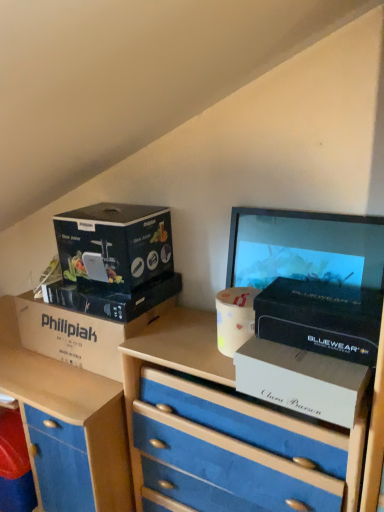
From the picture: In order to face white cardboard box at center-right, which is counted as the 4th box, starting from the left, should I rotate leftwards or rightwards?

Turn right approximately 14.653 degrees to face it.

The image size is (384, 512). Describe the element at coordinates (114, 244) in the screenshot. I see `matte black box at upper left, the fourth box positioned from the right` at that location.

What do you see at coordinates (59, 462) in the screenshot? I see `blue matte drawer at lower left` at bounding box center [59, 462].

In order to face blue matte drawer at lower left, should I rotate leftwards or rightwards?

Turn left by 21.930 degrees to look at blue matte drawer at lower left.

In order to face blue fabric chest of drawers at center, should I rotate leftwards or rightwards?

You should look right and rotate roughly 7.355 degrees.

In order to face matte black box at left, which appears as the 3th box when viewed from the right, should I rotate leftwards or rightwards?

Turn left by 9.926 degrees to look at matte black box at left, which appears as the 3th box when viewed from the right.

You are a GUI agent. You are given a task and a screenshot of the screen. Output one action in this format:
    pyautogui.click(x=<x>, y=<y>)
    Task: Click on the matte black computer monitor at upper right
    
    Given the screenshot: What is the action you would take?
    pyautogui.click(x=303, y=247)

Identify the location of black matte box at center-right, which is the fifth box in left-to-right order. (321, 318).

Does point (228, 487) come in front of point (349, 223)?

That is False.

Looking at the image, does blue fabric chest of drawers at center seem bigger or smaller compared to matte black computer monitor at upper right?

Clearly, blue fabric chest of drawers at center is larger in size than matte black computer monitor at upper right.

From the picture: Which object is positioned more to the right, blue fabric chest of drawers at center or matte black computer monitor at upper right?

Positioned to the right is matte black computer monitor at upper right.

Which of these two, blue fabric chest of drawers at center or matte black computer monitor at upper right, stands shorter?

With less height is matte black computer monitor at upper right.

Which object is wider, matte black box at left, which appears as the 3th box when viewed from the right, or white cardboard box at left, the first box positioned from the left?

matte black box at left, which appears as the 3th box when viewed from the right.

Is matte black box at left, marked as the 3th box in a left-to-right arrangement, oriented away from white cardboard box at left, marked as the fifth box in a right-to-left arrangement?

No, matte black box at left, marked as the 3th box in a left-to-right arrangement, is not facing the opposite direction of white cardboard box at left, marked as the fifth box in a right-to-left arrangement.

Is point (117, 295) farther from viewer compared to point (91, 359)?

No, (117, 295) is closer to viewer.

Which of these two, blue fabric chest of drawers at center or black matte box at center-right, which is the fifth box in left-to-right order, stands shorter?

black matte box at center-right, which is the fifth box in left-to-right order.

From a real-world perspective, which object stands above the other?

black matte box at center-right, which is the fifth box in left-to-right order, from a real-world perspective.

Between blue fabric chest of drawers at center and black matte box at center-right, which appears as the 1th box when viewed from the right, which one is positioned behind?

black matte box at center-right, which appears as the 1th box when viewed from the right, is further away from the camera.

In the scene shown: From the image's perspective, is blue fabric chest of drawers at center located beneath black matte box at center-right, which is the fifth box in left-to-right order?

Yes, from the image's perspective, blue fabric chest of drawers at center is below black matte box at center-right, which is the fifth box in left-to-right order.

In the image, is matte black box at upper left, the fourth box positioned from the right, on the left side or the right side of white cardboard box at center-right, which is counted as the 4th box, starting from the left?

Based on their positions, matte black box at upper left, the fourth box positioned from the right, is located to the left of white cardboard box at center-right, which is counted as the 4th box, starting from the left.

Which object is more forward, matte black box at upper left, positioned as the second box in left-to-right order, or white cardboard box at center-right, which is counted as the 4th box, starting from the left?

white cardboard box at center-right, which is counted as the 4th box, starting from the left.

Considering the relative sizes of matte black box at upper left, the fourth box positioned from the right, and white cardboard box at center-right, the second box viewed from the right, in the image provided, is matte black box at upper left, the fourth box positioned from the right, bigger than white cardboard box at center-right, the second box viewed from the right,?

Yes, matte black box at upper left, the fourth box positioned from the right, is bigger than white cardboard box at center-right, the second box viewed from the right.

Where is `computer monitor in front of the matte black box at left, marked as the 3th box in a left-to-right arrangement`? The height and width of the screenshot is (512, 384). computer monitor in front of the matte black box at left, marked as the 3th box in a left-to-right arrangement is located at coordinates pyautogui.click(x=303, y=247).

Does matte black box at left, marked as the 3th box in a left-to-right arrangement, lie behind matte black computer monitor at upper right?

Yes, the depth of matte black box at left, marked as the 3th box in a left-to-right arrangement, is greater than that of matte black computer monitor at upper right.

Considering the relative positions of matte black box at left, marked as the 3th box in a left-to-right arrangement, and matte black computer monitor at upper right in the image provided, is matte black box at left, marked as the 3th box in a left-to-right arrangement, to the left or to the right of matte black computer monitor at upper right?

Based on their positions, matte black box at left, marked as the 3th box in a left-to-right arrangement, is located to the left of matte black computer monitor at upper right.

In terms of width, does matte black box at left, marked as the 3th box in a left-to-right arrangement, look wider or thinner when compared to matte black computer monitor at upper right?

In the image, matte black box at left, marked as the 3th box in a left-to-right arrangement, appears to be wider than matte black computer monitor at upper right.

Is the depth of blue fabric chest of drawers at center greater than that of matte black box at upper left, positioned as the second box in left-to-right order?

No, blue fabric chest of drawers at center is closer to the viewer.

Between point (165, 501) and point (98, 253), which one is positioned in front?

The point (98, 253) is more forward.

Considering the sizes of blue fabric chest of drawers at center and matte black box at upper left, the fourth box positioned from the right, in the image, is blue fabric chest of drawers at center taller or shorter than matte black box at upper left, the fourth box positioned from the right,?

blue fabric chest of drawers at center is taller than matte black box at upper left, the fourth box positioned from the right.

Is black matte box at center-right, which is the fifth box in left-to-right order, next to matte black box at upper left, positioned as the second box in left-to-right order?

No, black matte box at center-right, which is the fifth box in left-to-right order, is not with matte black box at upper left, positioned as the second box in left-to-right order.

You are a GUI agent. You are given a task and a screenshot of the screen. Output one action in this format:
    pyautogui.click(x=<x>, y=<y>)
    Task: Click on the box above the black matte box at center-right, which appears as the 1th box when viewed from the right (from a real-world perspective)
    
    Given the screenshot: What is the action you would take?
    pos(114,244)

From a real-world perspective, is black matte box at center-right, which appears as the 1th box when viewed from the right, located higher than matte black box at upper left, positioned as the second box in left-to-right order?

No, from a real-world perspective, black matte box at center-right, which appears as the 1th box when viewed from the right, is not on top of matte black box at upper left, positioned as the second box in left-to-right order.

Which of these two, black matte box at center-right, which appears as the 1th box when viewed from the right, or matte black box at upper left, positioned as the second box in left-to-right order, stands taller?

With more height is matte black box at upper left, positioned as the second box in left-to-right order.

Find the location of a particular element. The width and height of the screenshot is (384, 512). computer monitor that appears above the blue fabric chest of drawers at center (from the image's perspective) is located at coordinates (303, 247).

From the image's perspective, count 2nd boxs downward from the matte black box at left, which appears as the 3th box when viewed from the right, and point to it. Please provide its 2D coordinates.

[(79, 334)]

Which object lies further to the anchor point blue fabric chest of drawers at center, matte black box at left, which appears as the 3th box when viewed from the right, or white cardboard box at center-right, the second box viewed from the right?

matte black box at left, which appears as the 3th box when viewed from the right, is positioned further to the anchor blue fabric chest of drawers at center.

Considering their positions, is black matte box at center-right, which appears as the 1th box when viewed from the right, positioned further to blue matte drawer at lower left than matte black computer monitor at upper right?

Based on the image, matte black computer monitor at upper right appears to be further to blue matte drawer at lower left.

Consider the image. Looking at the image, which one is located closer to blue fabric chest of drawers at center, blue matte drawer at lower left or matte black box at upper left, positioned as the second box in left-to-right order?

blue matte drawer at lower left is positioned closer to the anchor blue fabric chest of drawers at center.

Estimate the real-world distances between objects in this image. Which object is further from blue matte drawer at lower left, matte black computer monitor at upper right or white cardboard box at center-right, which is counted as the 4th box, starting from the left?

matte black computer monitor at upper right lies further to blue matte drawer at lower left than the other object.

From the image, which object appears to be nearer to matte black box at upper left, the fourth box positioned from the right, blue fabric chest of drawers at center or black matte box at center-right, which is the fifth box in left-to-right order?

Based on the image, blue fabric chest of drawers at center appears to be nearer to matte black box at upper left, the fourth box positioned from the right.

From the image, which object appears to be farther from white cardboard box at left, the first box positioned from the left, white cardboard box at center-right, which is counted as the 4th box, starting from the left, or matte black box at left, marked as the 3th box in a left-to-right arrangement?

Among the two, white cardboard box at center-right, which is counted as the 4th box, starting from the left, is located further to white cardboard box at left, the first box positioned from the left.

Which object lies nearer to the anchor point blue fabric chest of drawers at center, blue matte drawer at lower left or matte black box at left, which appears as the 3th box when viewed from the right?

blue matte drawer at lower left is closer to blue fabric chest of drawers at center.

From the image, which object appears to be nearer to white cardboard box at center-right, the second box viewed from the right, blue fabric chest of drawers at center or matte black box at left, marked as the 3th box in a left-to-right arrangement?

blue fabric chest of drawers at center is positioned closer to the anchor white cardboard box at center-right, the second box viewed from the right.

This screenshot has height=512, width=384. Identify the location of box situated between matte black box at upper left, the fourth box positioned from the right, and white cardboard box at center-right, the second box viewed from the right, from left to right. (113, 297).

What are the coordinates of `chest of drawers between white cardboard box at left, marked as the fifth box in a right-to-left arrangement, and matte black computer monitor at upper right, in the horizontal direction` in the screenshot? It's located at (226, 432).

Find the location of `computer monitor located between white cardboard box at left, marked as the fifth box in a right-to-left arrangement, and black matte box at center-right, which is the fifth box in left-to-right order, in the left-right direction`. computer monitor located between white cardboard box at left, marked as the fifth box in a right-to-left arrangement, and black matte box at center-right, which is the fifth box in left-to-right order, in the left-right direction is located at coordinates (303, 247).

Find the location of a particular element. The height and width of the screenshot is (512, 384). computer monitor situated between matte black box at upper left, positioned as the second box in left-to-right order, and black matte box at center-right, which is the fifth box in left-to-right order, from left to right is located at coordinates (303, 247).